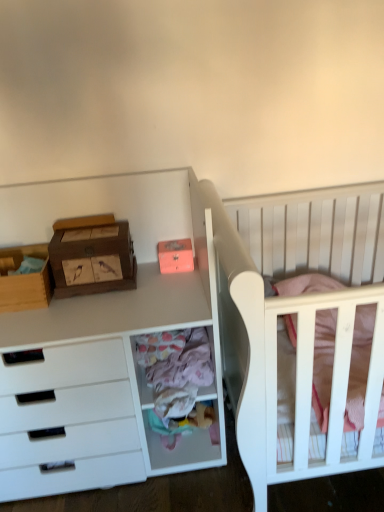
Question: Does wooden storage box at left, arranged as the 1th storage box when viewed from the left, have a larger size compared to pastel fabric drawer at center?

Choices:
 (A) yes
 (B) no

Answer: (B)

Question: From the image's perspective, does wooden storage box at left, arranged as the 1th storage box when viewed from the left, appear higher than pastel fabric drawer at center?

Choices:
 (A) yes
 (B) no

Answer: (A)

Question: From the image's perspective, is wooden storage box at left, arranged as the 1th storage box when viewed from the left, located beneath pastel fabric drawer at center?

Choices:
 (A) no
 (B) yes

Answer: (A)

Question: Is wooden storage box at left, arranged as the 1th storage box when viewed from the left, outside pastel fabric drawer at center?

Choices:
 (A) no
 (B) yes

Answer: (B)

Question: Can pastel fabric drawer at center be found inside wooden storage box at left, arranged as the 1th storage box when viewed from the left?

Choices:
 (A) yes
 (B) no

Answer: (B)

Question: From a real-world perspective, is wooden storage box at left, acting as the 2th storage box starting from the right, under pastel fabric drawer at center?

Choices:
 (A) yes
 (B) no

Answer: (B)

Question: Does pastel fabric drawer at center have a lesser width compared to white wood crib at right?

Choices:
 (A) yes
 (B) no

Answer: (A)

Question: From a real-world perspective, is pastel fabric drawer at center over white wood crib at right?

Choices:
 (A) no
 (B) yes

Answer: (A)

Question: Could you tell me if pastel fabric drawer at center is turned towards white wood crib at right?

Choices:
 (A) yes
 (B) no

Answer: (B)

Question: Is pastel fabric drawer at center with white wood crib at right?

Choices:
 (A) yes
 (B) no

Answer: (B)

Question: Is pastel fabric drawer at center to the right of white wood crib at right from the viewer's perspective?

Choices:
 (A) no
 (B) yes

Answer: (A)

Question: Does pastel fabric drawer at center have a lesser height compared to white wood crib at right?

Choices:
 (A) no
 (B) yes

Answer: (B)

Question: Is wooden storage box at left, arranged as the 1th storage box when viewed from the left, positioned with its back to white wood crib at right?

Choices:
 (A) yes
 (B) no

Answer: (B)